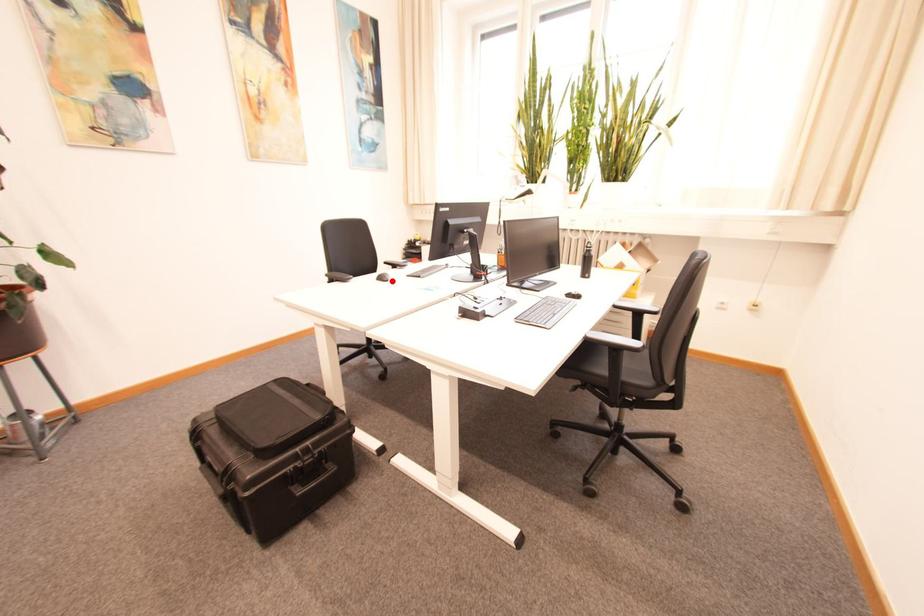
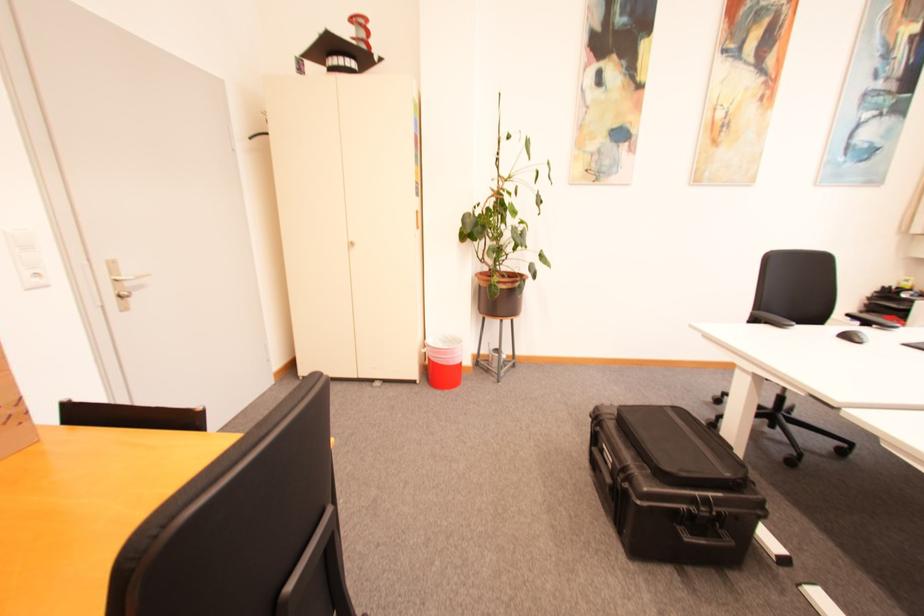
The point at the highlighted location is marked in the first image. Where is the corresponding point in the second image?

(865, 342)